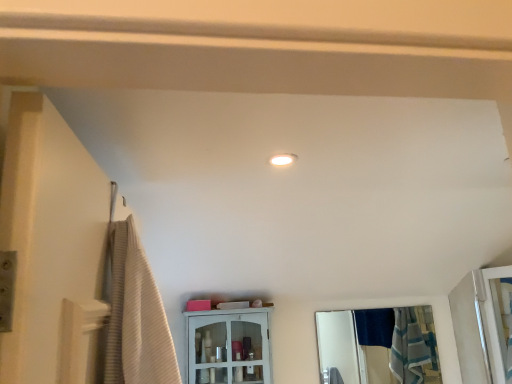
Question: From the image's perspective, relative to clear glass mirror at center, is clear glass screen door at right above or below?

Choices:
 (A) below
 (B) above

Answer: (B)

Question: Visually, is clear glass screen door at right positioned to the left or to the right of clear glass mirror at center?

Choices:
 (A) right
 (B) left

Answer: (A)

Question: Which object is the closest to the clear glass mirror at center?

Choices:
 (A) clear glass screen door at right
 (B) white glossy cabinet at center

Answer: (A)

Question: Estimate the real-world distances between objects in this image. Which object is closer to the clear glass mirror at center?

Choices:
 (A) clear glass screen door at right
 (B) white glossy cabinet at center

Answer: (A)